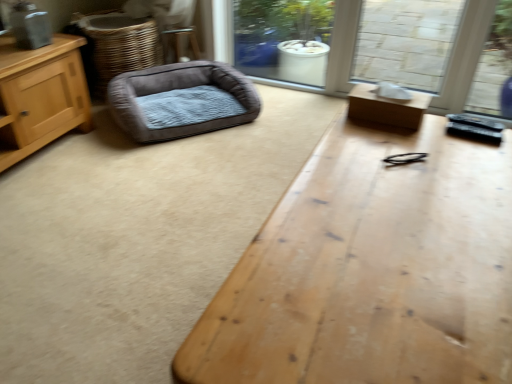
Question: Are wooden table at center, the 1th table when ordered from bottom to top, and brown cardboard box at right, positioned as the second table in bottom-to-top order, located far from each other?

Choices:
 (A) yes
 (B) no

Answer: (B)

Question: From the image's perspective, is wooden table at center, which is the 2th table in top-to-bottom order, located above brown cardboard box at right, marked as the 1th table in a top-to-bottom arrangement?

Choices:
 (A) yes
 (B) no

Answer: (B)

Question: From a real-world perspective, is wooden table at center, which is the 2th table in top-to-bottom order, located beneath brown cardboard box at right, positioned as the second table in bottom-to-top order?

Choices:
 (A) yes
 (B) no

Answer: (A)

Question: Is wooden table at center, the 1th table when ordered from bottom to top, in front of brown cardboard box at right, positioned as the second table in bottom-to-top order?

Choices:
 (A) no
 (B) yes

Answer: (B)

Question: Is wooden table at center, which is the 2th table in top-to-bottom order, taller than brown cardboard box at right, positioned as the second table in bottom-to-top order?

Choices:
 (A) yes
 (B) no

Answer: (A)

Question: Based on their positions, is wooden table at center, which is the 2th table in top-to-bottom order, located to the left or right of brown cardboard box at right, marked as the 1th table in a top-to-bottom arrangement?

Choices:
 (A) left
 (B) right

Answer: (A)

Question: From the image's perspective, is wooden table at center, which is the 2th table in top-to-bottom order, above or below brown cardboard box at right, positioned as the second table in bottom-to-top order?

Choices:
 (A) below
 (B) above

Answer: (A)

Question: Is wooden table at center, the 1th table when ordered from bottom to top, taller or shorter than brown cardboard box at right, marked as the 1th table in a top-to-bottom arrangement?

Choices:
 (A) tall
 (B) short

Answer: (A)

Question: Based on their sizes in the image, would you say wooden table at center, the 1th table when ordered from bottom to top, is bigger or smaller than brown cardboard box at right, positioned as the second table in bottom-to-top order?

Choices:
 (A) small
 (B) big

Answer: (B)

Question: In terms of width, does brown cardboard box at right, marked as the 1th table in a top-to-bottom arrangement, look wider or thinner when compared to velvet-like brown dog bed at left?

Choices:
 (A) wide
 (B) thin

Answer: (B)

Question: Looking at the image, does brown cardboard box at right, positioned as the second table in bottom-to-top order, seem bigger or smaller compared to velvet-like brown dog bed at left?

Choices:
 (A) big
 (B) small

Answer: (B)

Question: From their relative heights in the image, would you say brown cardboard box at right, marked as the 1th table in a top-to-bottom arrangement, is taller or shorter than velvet-like brown dog bed at left?

Choices:
 (A) short
 (B) tall

Answer: (A)

Question: Is brown cardboard box at right, positioned as the second table in bottom-to-top order, spatially inside velvet-like brown dog bed at left, or outside of it?

Choices:
 (A) outside
 (B) inside

Answer: (A)

Question: From a real-world perspective, relative to brown woven basket at left, is brown cardboard box at right, positioned as the second table in bottom-to-top order, vertically above or below?

Choices:
 (A) below
 (B) above

Answer: (B)

Question: Is point (360, 87) positioned closer to the camera than point (148, 56)?

Choices:
 (A) closer
 (B) farther

Answer: (A)